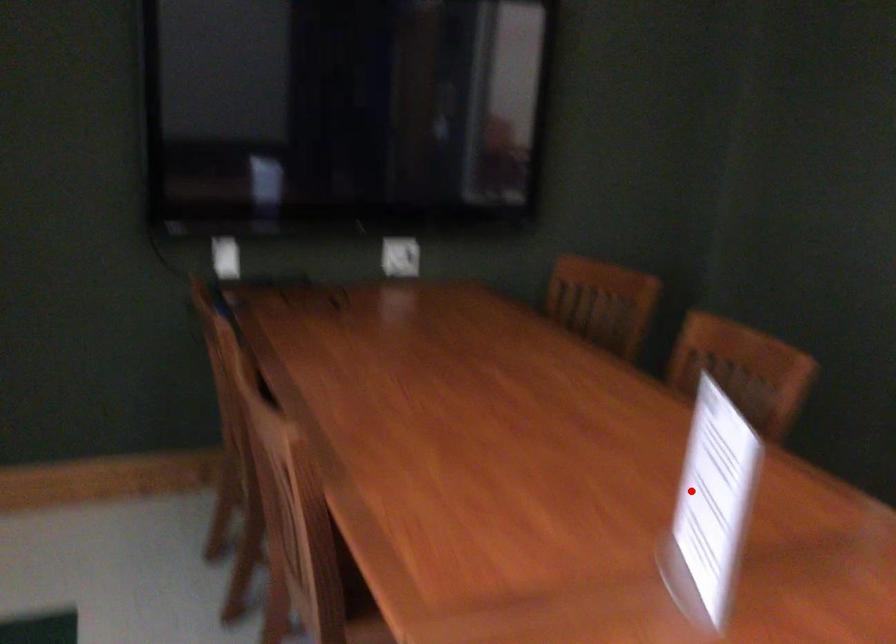
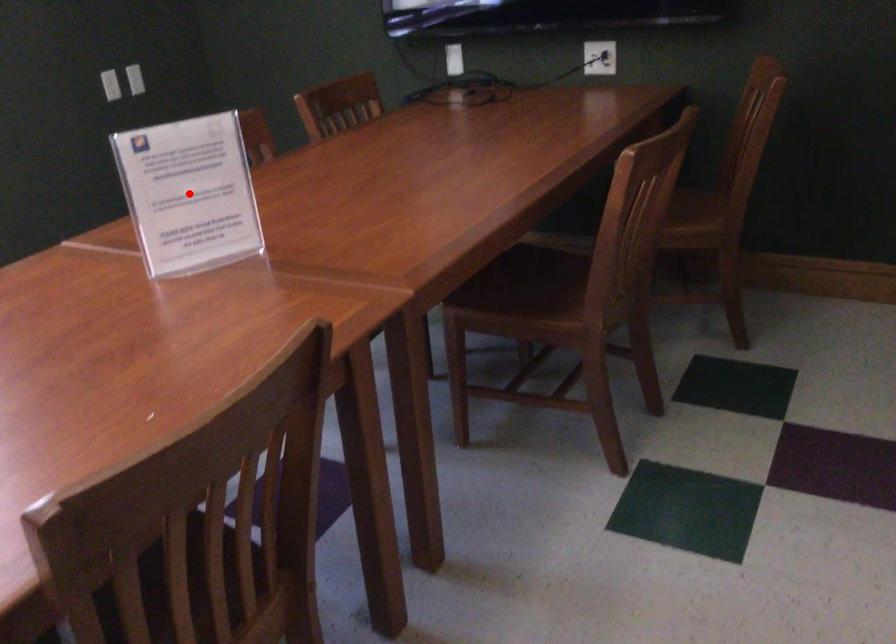
I am providing you with two images of the same scene from different viewpoints. A red point is marked on the first image and another point is marked on the second image. Do the highlighted points in image1 and image2 indicate the same real-world spot?

Yes